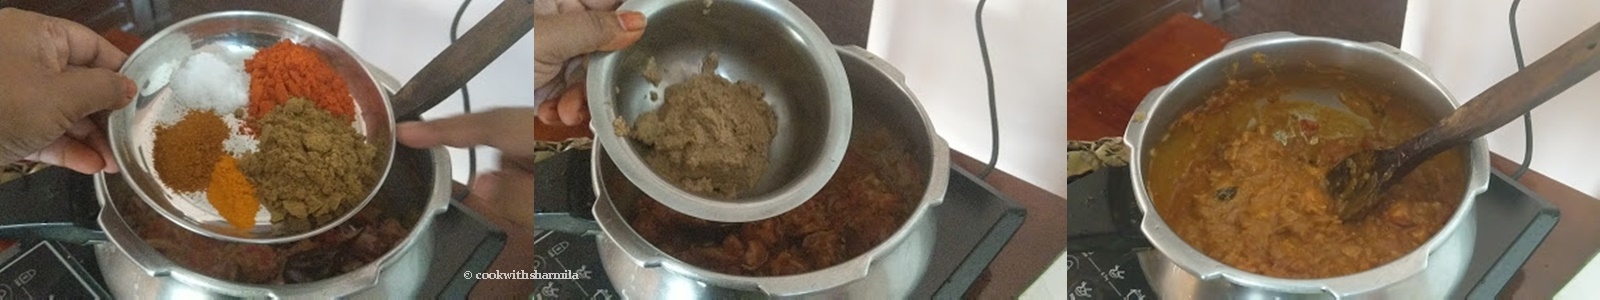
The height and width of the screenshot is (300, 1600). I want to click on matte silver bowl, so click(733, 206).